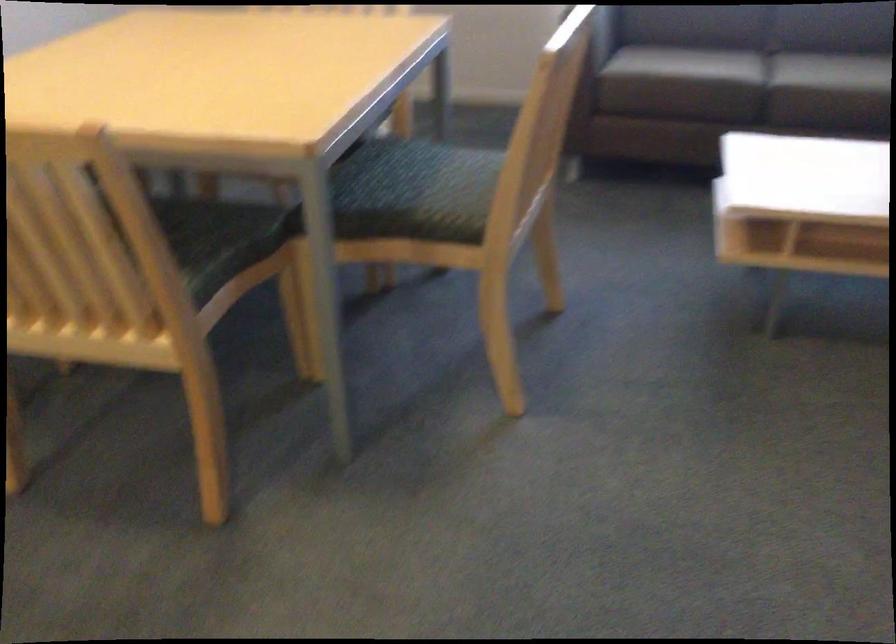
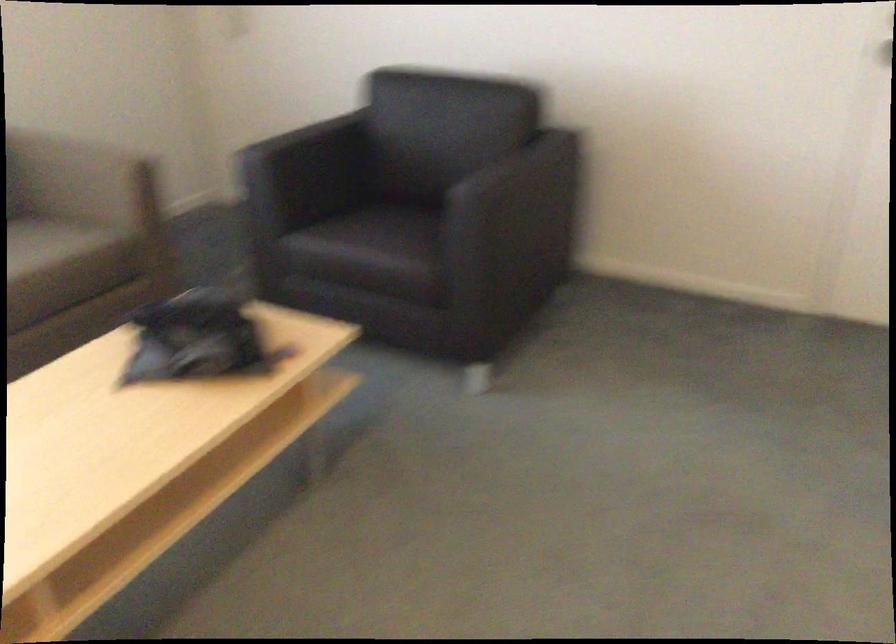
Based on the continuous images, in which direction is the camera rotating?

The camera's rotation is toward right-down.